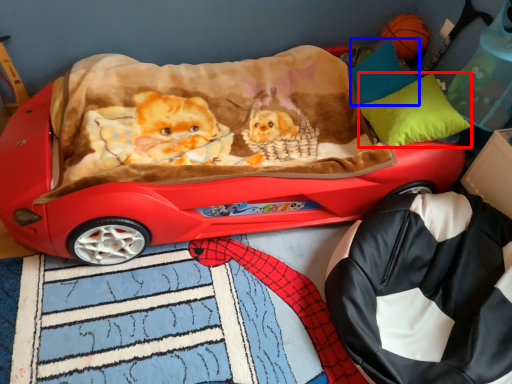
Question: Which of the following is the farthest to the observer, pillow (highlighted by a red box) or pillow (highlighted by a blue box)?

Choices:
 (A) pillow
 (B) pillow

Answer: (B)